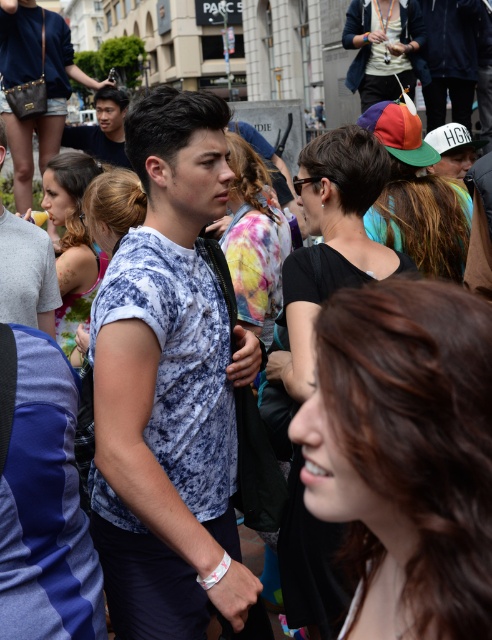
What do you see at coordinates (170, 392) in the screenshot? The width and height of the screenshot is (492, 640). I see `tie-dye fabric shirt at center` at bounding box center [170, 392].

Find the location of `tie-dye fabric shirt at center`. tie-dye fabric shirt at center is located at coordinates (170, 392).

Measure the distance between matte white t-shirt at center and matte black shirt at upper center.

A distance of 18.50 meters exists between matte white t-shirt at center and matte black shirt at upper center.

Does matte white t-shirt at center have a lesser width compared to matte black shirt at upper center?

Yes, matte white t-shirt at center is thinner than matte black shirt at upper center.

Between point (22, 275) and point (102, 102), which one is positioned in front?

Point (22, 275)

Where is `matte white t-shirt at center`? The image size is (492, 640). matte white t-shirt at center is located at coordinates (27, 275).

Is tie-dye fabric shirt at center to the right of matte white t-shirt at center from the viewer's perspective?

Yes, tie-dye fabric shirt at center is to the right of matte white t-shirt at center.

Between tie-dye fabric shirt at center and matte white t-shirt at center, which one has more height?

tie-dye fabric shirt at center is taller.

Find the location of `tie-dye fabric shirt at center`. tie-dye fabric shirt at center is located at coordinates (170, 392).